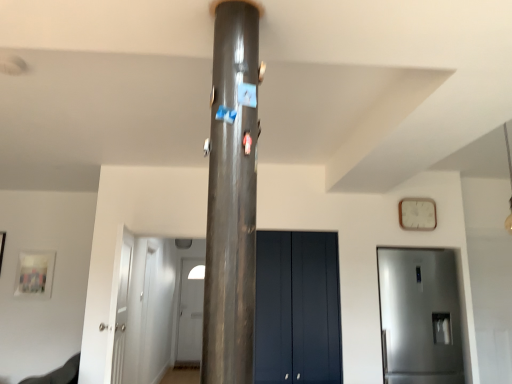
This screenshot has height=384, width=512. What are the coordinates of `white wooden clock at upper right` in the screenshot? It's located at (417, 214).

What do you see at coordinates (417, 214) in the screenshot?
I see `white wooden clock at upper right` at bounding box center [417, 214].

I want to click on white glossy door at center, which is counted as the first door, starting from the back, so click(x=190, y=313).

What do you see at coordinates (297, 308) in the screenshot?
I see `matte dark blue cabinet at center, which ranks as the second door in right-to-left order` at bounding box center [297, 308].

In order to click on white glossy door at left, which ranks as the first door in front-to-back order in this screenshot , I will do (x=121, y=303).

In the scene shown: In the image, is white glossy door at center, the 1th door viewed from the left, positioned in front of or behind white glossy door at left, which ranks as the third door in right-to-left order?

Visually, white glossy door at center, the 1th door viewed from the left, is located behind white glossy door at left, which ranks as the third door in right-to-left order.

Does white glossy door at center, which is the 4th door in front-to-back order, have a smaller size compared to white glossy door at left, the 2th door when ordered from left to right?

Indeed, white glossy door at center, which is the 4th door in front-to-back order, has a smaller size compared to white glossy door at left, the 2th door when ordered from left to right.

From the picture: Can you tell me how much white glossy door at center, the fourth door when ordered from right to left, and white glossy door at left, which ranks as the third door in right-to-left order, differ in facing direction?

97.7 degrees.

Is matte dark blue cabinet at center, which ranks as the second door in right-to-left order, turned away from satin silver refrigerator at right, which is the second door in front-to-back order?

No.

From the image's perspective, is matte dark blue cabinet at center, placed as the 3th door when sorted from front to back, located above or below satin silver refrigerator at right, which is the second door in front-to-back order?

Clearly, from the image's perspective, matte dark blue cabinet at center, placed as the 3th door when sorted from front to back, is above satin silver refrigerator at right, which is the second door in front-to-back order.

Is matte dark blue cabinet at center, placed as the 3th door when sorted from left to right, thinner than satin silver refrigerator at right, which ranks as the first door in right-to-left order?

Indeed, matte dark blue cabinet at center, placed as the 3th door when sorted from left to right, has a lesser width compared to satin silver refrigerator at right, which ranks as the first door in right-to-left order.

Is matte dark blue cabinet at center, placed as the 3th door when sorted from front to back, located outside satin silver refrigerator at right, which is the second door in front-to-back order?

Absolutely, matte dark blue cabinet at center, placed as the 3th door when sorted from front to back, is external to satin silver refrigerator at right, which is the second door in front-to-back order.

Is white glossy door at center, which is the 4th door in front-to-back order, situated inside matte dark blue cabinet at center, marked as the second door in a back-to-front arrangement, or outside?

white glossy door at center, which is the 4th door in front-to-back order, is outside matte dark blue cabinet at center, marked as the second door in a back-to-front arrangement.

Considering the relative sizes of white glossy door at center, the fourth door when ordered from right to left, and matte dark blue cabinet at center, marked as the second door in a back-to-front arrangement, in the image provided, is white glossy door at center, the fourth door when ordered from right to left, wider than matte dark blue cabinet at center, marked as the second door in a back-to-front arrangement,?

Correct, the width of white glossy door at center, the fourth door when ordered from right to left, exceeds that of matte dark blue cabinet at center, marked as the second door in a back-to-front arrangement.

Is white wooden clock at upper right bigger than satin silver refrigerator at right, positioned as the 4th door in left-to-right order?

Actually, white wooden clock at upper right might be smaller than satin silver refrigerator at right, positioned as the 4th door in left-to-right order.

Which object is more forward, white wooden clock at upper right or satin silver refrigerator at right, which ranks as the first door in right-to-left order?

satin silver refrigerator at right, which ranks as the first door in right-to-left order, is in front.

From the picture: Does white wooden clock at upper right have a greater height compared to satin silver refrigerator at right, which ranks as the first door in right-to-left order?

In fact, white wooden clock at upper right may be shorter than satin silver refrigerator at right, which ranks as the first door in right-to-left order.

In the scene shown: Is white wooden clock at upper right aimed at satin silver refrigerator at right, which is the second door in front-to-back order?

No.

From the picture: Relative to shiny metallic pillar at center, is satin silver refrigerator at right, which ranks as the first door in right-to-left order, in front or behind?

Clearly, satin silver refrigerator at right, which ranks as the first door in right-to-left order, is behind shiny metallic pillar at center.

Can you confirm if satin silver refrigerator at right, positioned as the 3th door in back-to-front order, is positioned to the left of shiny metallic pillar at center?

In fact, satin silver refrigerator at right, positioned as the 3th door in back-to-front order, is to the right of shiny metallic pillar at center.

Between satin silver refrigerator at right, positioned as the 3th door in back-to-front order, and shiny metallic pillar at center, which one has larger width?

With larger width is satin silver refrigerator at right, positioned as the 3th door in back-to-front order.

At what (x,y) coordinates should I click in order to perform the action: click on door that appears in front of the satin silver refrigerator at right, positioned as the 4th door in left-to-right order. Please return your answer as a coordinate pair (x, y). The image size is (512, 384). Looking at the image, I should click on point(121,303).

Between satin silver refrigerator at right, which is the second door in front-to-back order, and white glossy door at left, which ranks as the first door in front-to-back order, which one has smaller size?

white glossy door at left, which ranks as the first door in front-to-back order, is smaller.

Does point (406, 338) come in front of point (116, 364)?

No.

Is satin silver refrigerator at right, positioned as the 3th door in back-to-front order, oriented away from white glossy door at left, which ranks as the first door in front-to-back order?

No.

Is white glossy door at left, the 2th door when ordered from left to right, placed right next to white wooden clock at upper right?

They are not placed beside each other.

Based on the photo, is white glossy door at left, positioned as the 4th door in back-to-front order, positioned beyond the bounds of white wooden clock at upper right?

Yes, white glossy door at left, positioned as the 4th door in back-to-front order, is not within white wooden clock at upper right.

Does white glossy door at left, the 2th door when ordered from left to right, have a lesser height compared to white wooden clock at upper right?

No.

Can you confirm if white glossy door at left, the 2th door when ordered from left to right, is smaller than white wooden clock at upper right?

Actually, white glossy door at left, the 2th door when ordered from left to right, might be larger than white wooden clock at upper right.

At what (x,y) coordinates should I click in order to perform the action: click on the 3rd door above when counting from the white glossy door at center, the 1th door viewed from the left (from the image's perspective). Please return your answer as a coordinate pair (x, y). This screenshot has height=384, width=512. Looking at the image, I should click on 121,303.

Find the location of a particular element. The height and width of the screenshot is (384, 512). the 1st door behind the satin silver refrigerator at right, which is the second door in front-to-back order, counting from the anchor's position is located at coordinates (297, 308).

Looking at the image, which one is located further to matte dark blue cabinet at center, which ranks as the second door in right-to-left order, white wooden clock at upper right or white glossy door at center, the 1th door viewed from the left?

white glossy door at center, the 1th door viewed from the left, is further to matte dark blue cabinet at center, which ranks as the second door in right-to-left order.

Based on their spatial positions, is white glossy door at center, the 1th door viewed from the left, or white wooden clock at upper right further from matte dark blue cabinet at center, marked as the second door in a back-to-front arrangement?

The object further to matte dark blue cabinet at center, marked as the second door in a back-to-front arrangement, is white glossy door at center, the 1th door viewed from the left.

Considering their positions, is white glossy door at left, positioned as the 4th door in back-to-front order, positioned further to matte dark blue cabinet at center, which ranks as the second door in right-to-left order, than white wooden clock at upper right?

white glossy door at left, positioned as the 4th door in back-to-front order.

Estimate the real-world distances between objects in this image. Which object is closer to white glossy door at left, which ranks as the third door in right-to-left order, matte dark blue cabinet at center, placed as the 3th door when sorted from left to right, or white glossy door at center, which is the 4th door in front-to-back order?

Among the two, matte dark blue cabinet at center, placed as the 3th door when sorted from left to right, is located nearer to white glossy door at left, which ranks as the third door in right-to-left order.

Looking at the image, which one is located further to shiny metallic pillar at center, matte dark blue cabinet at center, placed as the 3th door when sorted from front to back, or white wooden clock at upper right?

white wooden clock at upper right lies further to shiny metallic pillar at center than the other object.

Looking at the image, which one is located further to shiny metallic pillar at center, white wooden clock at upper right or white glossy door at left, which ranks as the first door in front-to-back order?

Based on the image, white wooden clock at upper right appears to be further to shiny metallic pillar at center.

Estimate the real-world distances between objects in this image. Which object is further from white wooden clock at upper right, satin silver refrigerator at right, which ranks as the first door in right-to-left order, or matte dark blue cabinet at center, marked as the second door in a back-to-front arrangement?

matte dark blue cabinet at center, marked as the second door in a back-to-front arrangement.

Estimate the real-world distances between objects in this image. Which object is closer to white wooden clock at upper right, white glossy door at left, the 2th door when ordered from left to right, or satin silver refrigerator at right, which is the second door in front-to-back order?

satin silver refrigerator at right, which is the second door in front-to-back order, lies closer to white wooden clock at upper right than the other object.

Where is `clock positioned between shiny metallic pillar at center and white glossy door at center, the fourth door when ordered from right to left, from near to far`? clock positioned between shiny metallic pillar at center and white glossy door at center, the fourth door when ordered from right to left, from near to far is located at coordinates (417, 214).

You are a GUI agent. You are given a task and a screenshot of the screen. Output one action in this format:
    pyautogui.click(x=<x>, y=<y>)
    Task: Click on the door between matte dark blue cabinet at center, placed as the 3th door when sorted from front to back, and white wooden clock at upper right from left to right
    
    Given the screenshot: What is the action you would take?
    pyautogui.click(x=419, y=316)

This screenshot has height=384, width=512. I want to click on door between satin silver refrigerator at right, which is the second door in front-to-back order, and white glossy door at center, which is counted as the first door, starting from the back, along the z-axis, so click(297, 308).

This screenshot has height=384, width=512. Find the location of `clock between white glossy door at left, the 2th door when ordered from left to right, and white glossy door at center, the fourth door when ordered from right to left, in the front-back direction`. clock between white glossy door at left, the 2th door when ordered from left to right, and white glossy door at center, the fourth door when ordered from right to left, in the front-back direction is located at coordinates (417, 214).